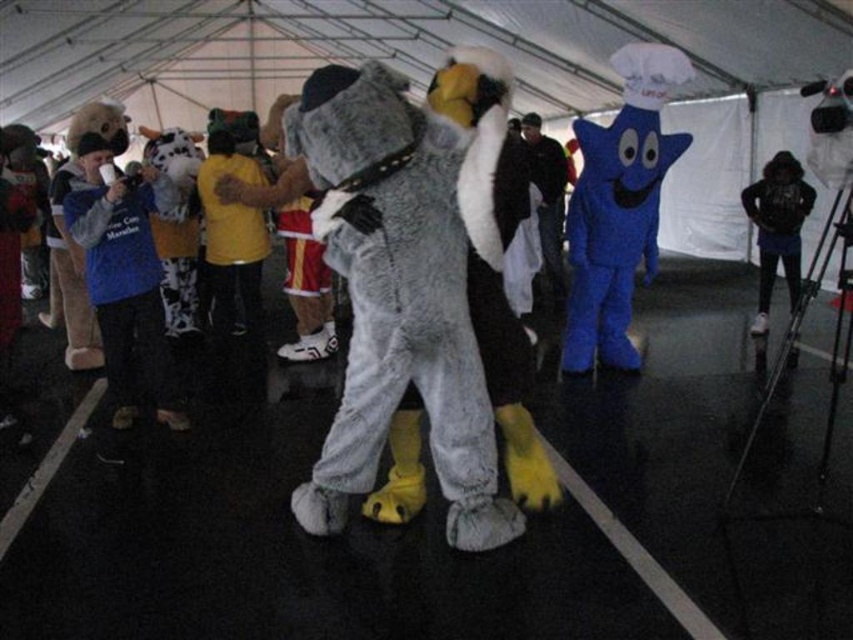
Who is lower down, blue plush star at center or blue fleece jacket at left?

blue fleece jacket at left is lower down.

Which of these two, blue plush star at center or blue fleece jacket at left, stands taller?

Standing taller between the two is blue plush star at center.

Identify the location of blue plush star at center. This screenshot has height=640, width=853. (618, 208).

You are a GUI agent. You are given a task and a screenshot of the screen. Output one action in this format:
    pyautogui.click(x=<x>, y=<y>)
    Task: Click on the blue plush star at center
    
    Given the screenshot: What is the action you would take?
    pyautogui.click(x=618, y=208)

Between point (341, 428) and point (550, 294), which one is positioned behind?

Point (550, 294)

Who is taller, fuzzy gray eagle at center or dark blue plush hat at center?

Standing taller between the two is dark blue plush hat at center.

At what (x,y) coordinates should I click in order to perform the action: click on fuzzy gray eagle at center. Please return your answer as a coordinate pair (x, y). Looking at the image, I should click on [x=397, y=298].

This screenshot has width=853, height=640. Identify the location of fuzzy gray eagle at center. (397, 298).

Who is lower down, blue fleece jacket at left or dark blue plush hat at center?

blue fleece jacket at left is below.

Does blue fleece jacket at left have a greater height compared to dark blue plush hat at center?

No, blue fleece jacket at left is not taller than dark blue plush hat at center.

This screenshot has height=640, width=853. What are the coordinates of `blue fleece jacket at left` in the screenshot? It's located at (125, 280).

Image resolution: width=853 pixels, height=640 pixels. Find the location of `blue fleece jacket at left`. blue fleece jacket at left is located at coordinates (125, 280).